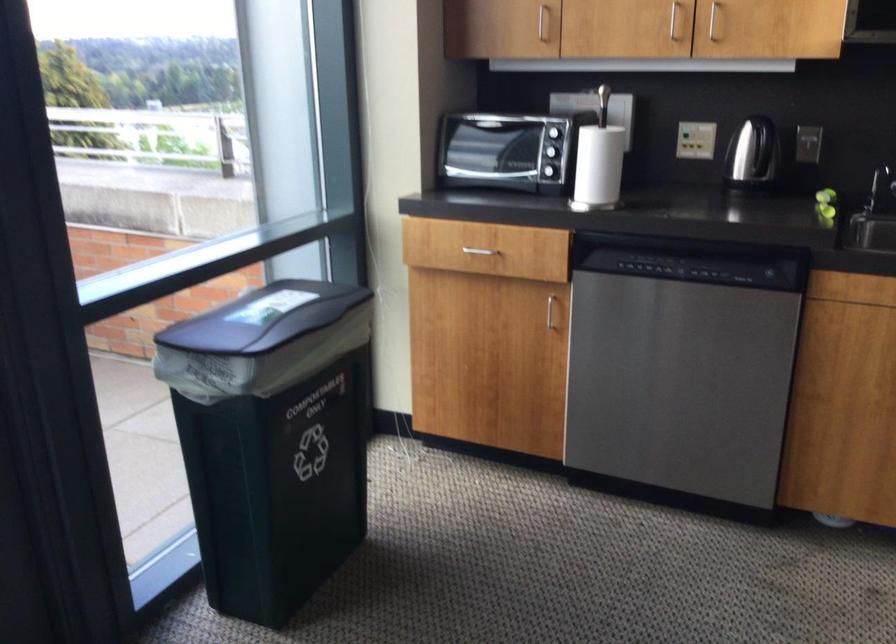
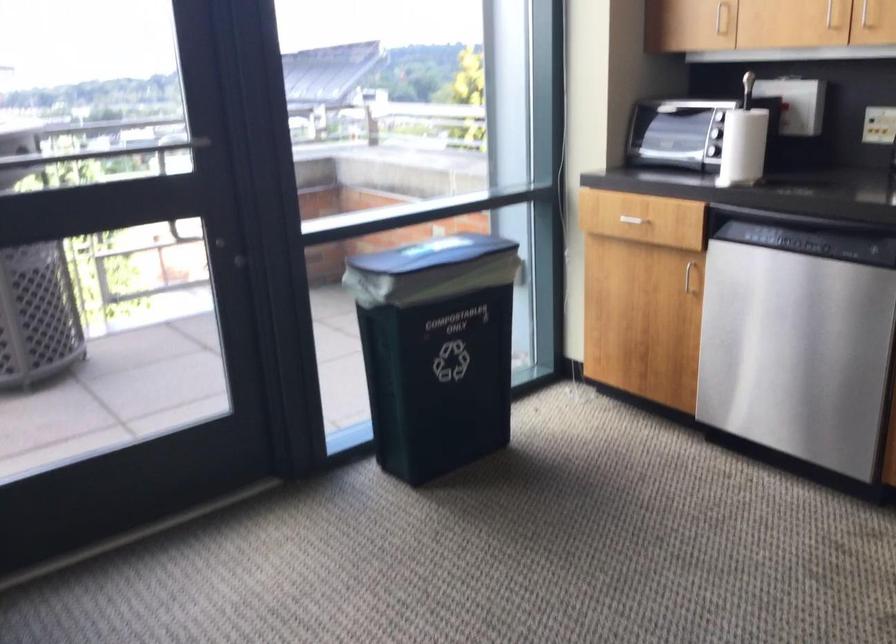
The point at (289, 442) is marked in the first image. Where is the corresponding point in the second image?

(435, 350)